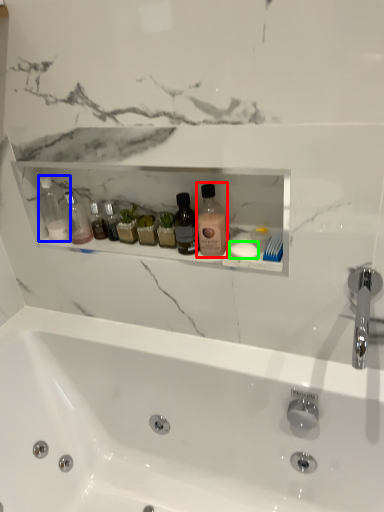
Question: Considering the real-world distances, which object is closest to cleaning product (highlighted by a red box)? toiletry (highlighted by a blue box) or soap (highlighted by a green box).

Choices:
 (A) toiletry
 (B) soap

Answer: (B)